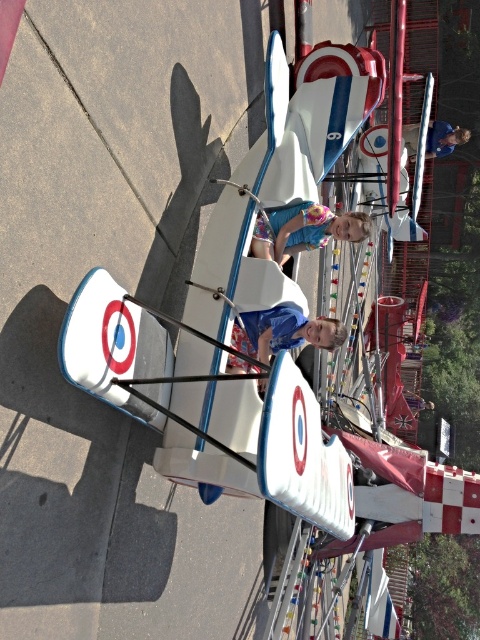
Question: Estimate the real-world distances between objects in this image. Which object is farther from the blue matte shirt at center?

Choices:
 (A) matte blue dress at center
 (B) matte blue helmet at upper center

Answer: (B)

Question: Does matte blue dress at center have a lesser width compared to matte blue helmet at upper center?

Choices:
 (A) yes
 (B) no

Answer: (A)

Question: From the image, what is the correct spatial relationship of blue matte shirt at center in relation to matte blue helmet at upper center?

Choices:
 (A) below
 (B) above

Answer: (A)

Question: Observing the image, what is the correct spatial positioning of matte blue dress at center in reference to matte blue helmet at upper center?

Choices:
 (A) below
 (B) above

Answer: (A)

Question: Which object appears farthest from the camera in this image?

Choices:
 (A) matte blue dress at center
 (B) blue matte shirt at center

Answer: (A)

Question: Among these points, which one is farthest from the camera?

Choices:
 (A) (454, 129)
 (B) (276, 252)
 (C) (254, 342)

Answer: (A)